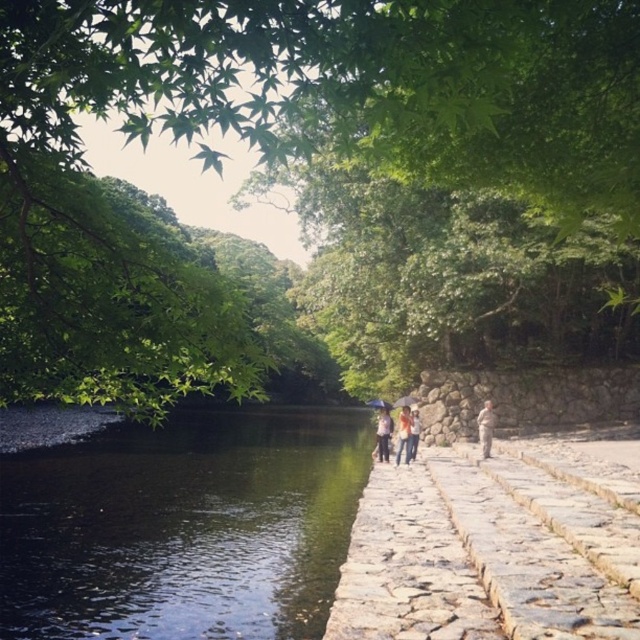
Is camouflage fabric person at lower right to the right of orange cotton shirt at center from the viewer's perspective?

Correct, you'll find camouflage fabric person at lower right to the right of orange cotton shirt at center.

Which is below, camouflage fabric person at lower right or orange cotton shirt at center?

Positioned lower is orange cotton shirt at center.

You are a GUI agent. You are given a task and a screenshot of the screen. Output one action in this format:
    pyautogui.click(x=<x>, y=<y>)
    Task: Click on the camouflage fabric person at lower right
    The height and width of the screenshot is (640, 640).
    Given the screenshot: What is the action you would take?
    pyautogui.click(x=484, y=428)

Image resolution: width=640 pixels, height=640 pixels. Identify the location of camouflage fabric person at lower right. (484, 428).

Which is above, green reflective water at lower left or orange cotton shirt at center?

orange cotton shirt at center is higher up.

Does point (54, 568) come farther from viewer compared to point (410, 426)?

No, (54, 568) is closer to viewer.

Locate an element on the screen. The image size is (640, 640). green reflective water at lower left is located at coordinates (182, 525).

Between green leafy tree at upper center and green reflective water at lower left, which one appears on the right side from the viewer's perspective?

green leafy tree at upper center is more to the right.

In the scene shown: Is green leafy tree at upper center positioned in front of green reflective water at lower left?

Yes.

Between point (19, 61) and point (205, 483), which one is positioned behind?

Point (205, 483)

This screenshot has width=640, height=640. I want to click on green leafy tree at upper center, so click(x=273, y=150).